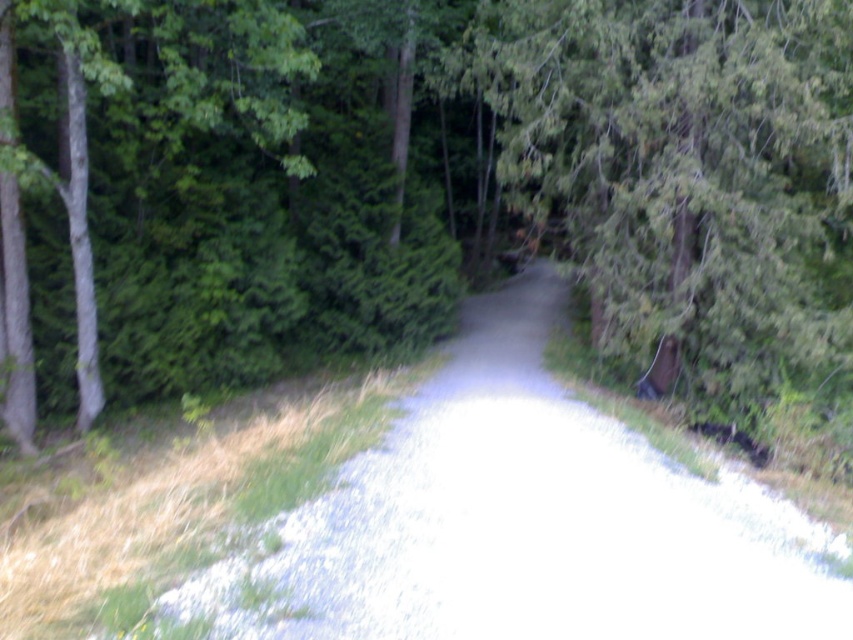
Question: Does gray gravel trail at center appear on the left side of green matte tree at left?

Choices:
 (A) yes
 (B) no

Answer: (B)

Question: Estimate the real-world distances between objects in this image. Which object is closer to the gray gravel trail at center?

Choices:
 (A) green textured tree at center
 (B) green leafy forest at center

Answer: (A)

Question: Which of the following is the closest to the observer?

Choices:
 (A) gray gravel trail at center
 (B) green matte tree at left
 (C) green textured tree at center
 (D) green leafy forest at center

Answer: (A)

Question: Which of the following is the farthest from the observer?

Choices:
 (A) (807, 29)
 (B) (16, 163)

Answer: (A)

Question: In this image, where is gray gravel trail at center located relative to green textured tree at center?

Choices:
 (A) left
 (B) right

Answer: (A)

Question: Is green leafy forest at center positioned behind green textured tree at center?

Choices:
 (A) yes
 (B) no

Answer: (B)